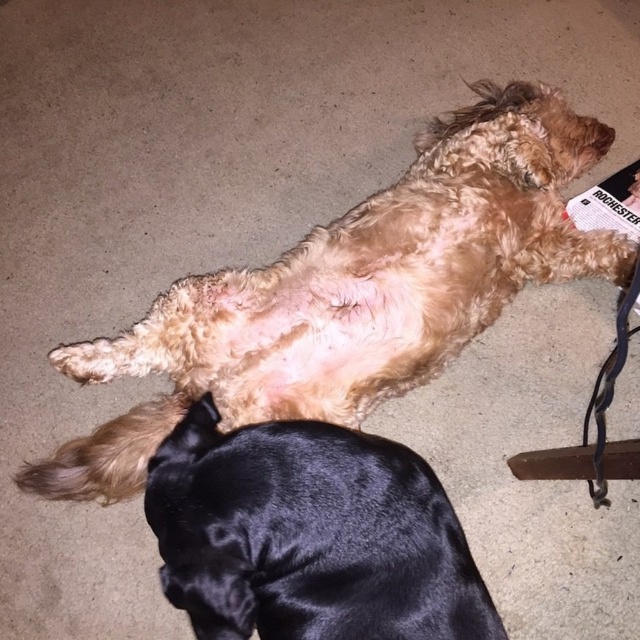
You are a dog groomer assessing the space needed for grooming two dogs in the image. The fuzzy brown dog at center and the black silky dog at lower center are both on the carpet. Which dog requires more space due to its size?

The fuzzy brown dog at center requires more space because it is bigger than the black silky dog at lower center.

You are a photographer trying to capture a photo of both the fuzzy brown dog at center and the black silky dog at lower center. Since you want to ensure both are in focus, you need to know their vertical positions. Which dog is positioned higher up in the image?

The fuzzy brown dog at center is located above the black silky dog at lower center, so it is positioned higher up in the image.

You are standing in the room where the fuzzy brown dog at center is lying. If you want to pet the dog without getting too close, what is the minimum distance you should maintain?

The minimum distance you should maintain is 4.07 feet, as that is the distance between you and the fuzzy brown dog at center.